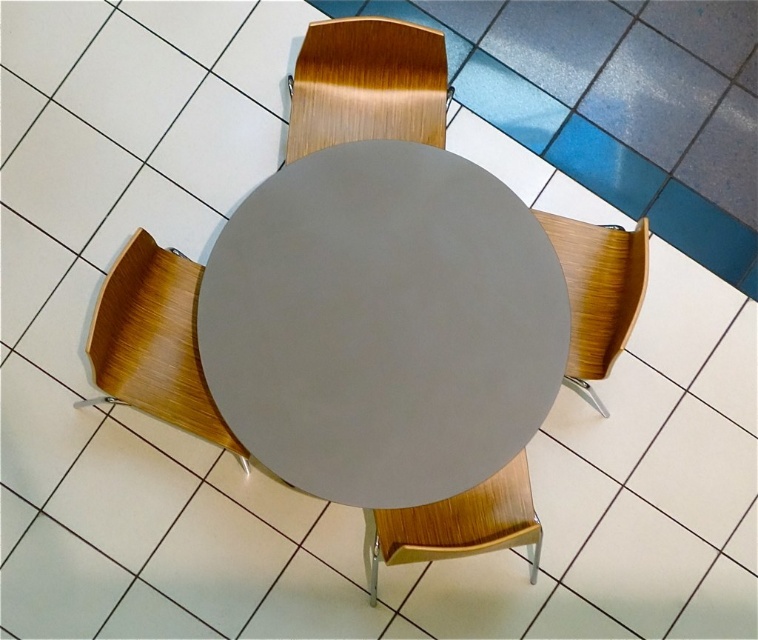
In the scene shown: Can you confirm if matte gray table at center is thinner than wooden chair at upper center?

No, matte gray table at center is not thinner than wooden chair at upper center.

Is matte gray table at center below wooden chair at upper center?

Yes, matte gray table at center is below wooden chair at upper center.

Is point (522, 205) behind point (396, 22)?

No, it is in front of (396, 22).

You are a GUI agent. You are given a task and a screenshot of the screen. Output one action in this format:
    pyautogui.click(x=<x>, y=<y>)
    Task: Click on the matte gray table at center
    Image resolution: width=758 pixels, height=640 pixels.
    Given the screenshot: What is the action you would take?
    pyautogui.click(x=381, y=324)

In the scene shown: Can you confirm if wooden chair at lower left is thinner than wooden chair at upper center?

No, wooden chair at lower left is not thinner than wooden chair at upper center.

Is wooden chair at lower left in front of wooden chair at upper center?

Yes, wooden chair at lower left is in front of wooden chair at upper center.

This screenshot has height=640, width=758. Describe the element at coordinates (152, 342) in the screenshot. I see `wooden chair at lower left` at that location.

Locate an element on the screen. Image resolution: width=758 pixels, height=640 pixels. wooden chair at lower left is located at coordinates (152, 342).

What do you see at coordinates (597, 292) in the screenshot? I see `wooden chair at right` at bounding box center [597, 292].

Locate an element on the screen. The width and height of the screenshot is (758, 640). wooden chair at right is located at coordinates (597, 292).